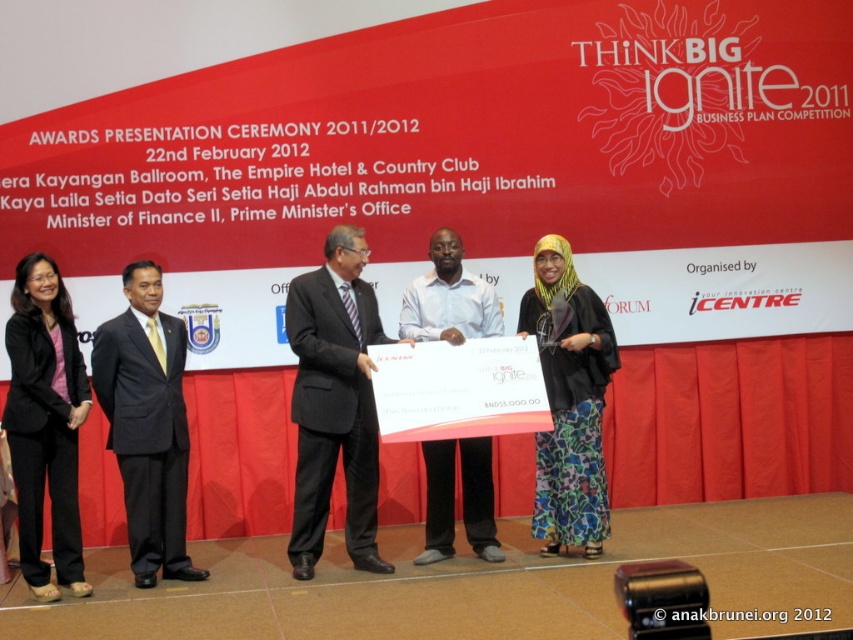
Can you confirm if black fabric pants at lower left is positioned below white shirt at center?

No.

Does black fabric pants at lower left lie in front of white shirt at center?

Yes, black fabric pants at lower left is in front of white shirt at center.

Measure the distance between point (51, 358) and camera.

4.93 meters

The height and width of the screenshot is (640, 853). Identify the location of black fabric pants at lower left. (45, 422).

Is point (364, 378) in front of point (33, 586)?

No, it is not.

Can you confirm if black suit at center is bigger than black fabric pants at lower left?

Yes.

Who is more forward, (335, 381) or (59, 435)?

Point (59, 435) is in front.

The image size is (853, 640). I want to click on black suit at center, so click(334, 401).

Does floral fabric dress at center lie behind white shirt at center?

That is False.

Between floral fabric dress at center and white shirt at center, which one has more height?

Standing taller between the two is floral fabric dress at center.

The height and width of the screenshot is (640, 853). What do you see at coordinates (569, 403) in the screenshot?
I see `floral fabric dress at center` at bounding box center [569, 403].

Locate an element on the screen. The width and height of the screenshot is (853, 640). floral fabric dress at center is located at coordinates (569, 403).